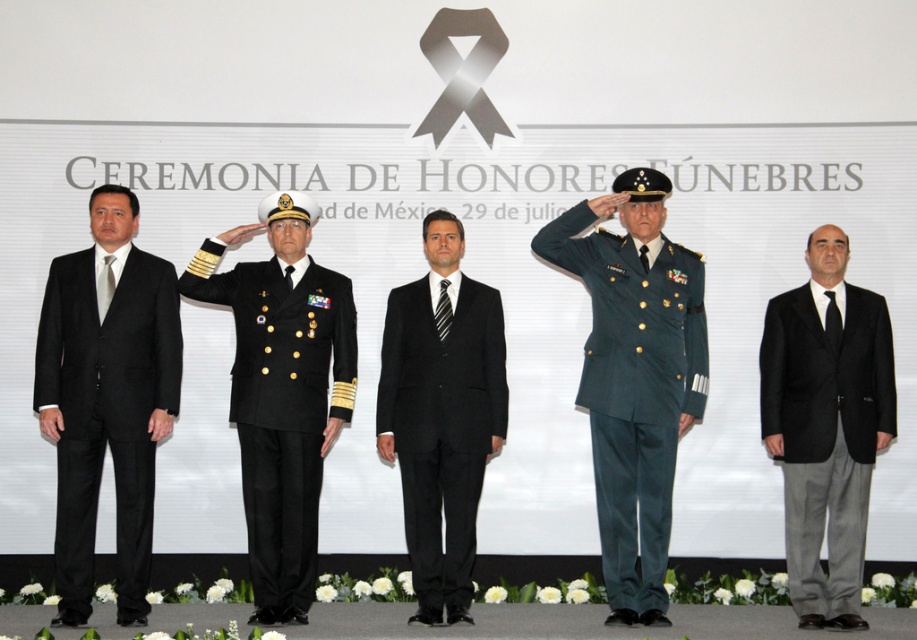
Which is in front, point (275, 547) or point (460, 397)?

Point (275, 547)

This screenshot has width=917, height=640. What do you see at coordinates (282, 406) in the screenshot?
I see `black wool military uniform at center` at bounding box center [282, 406].

Locate an element on the screen. black wool military uniform at center is located at coordinates (282, 406).

The image size is (917, 640). What are the coordinates of `satin black suit at left` in the screenshot? It's located at (106, 397).

Consider the image. Who is taller, green military uniform at center or black wool suit at right?

Standing taller between the two is green military uniform at center.

Where is `green military uniform at center`? green military uniform at center is located at coordinates pyautogui.click(x=634, y=384).